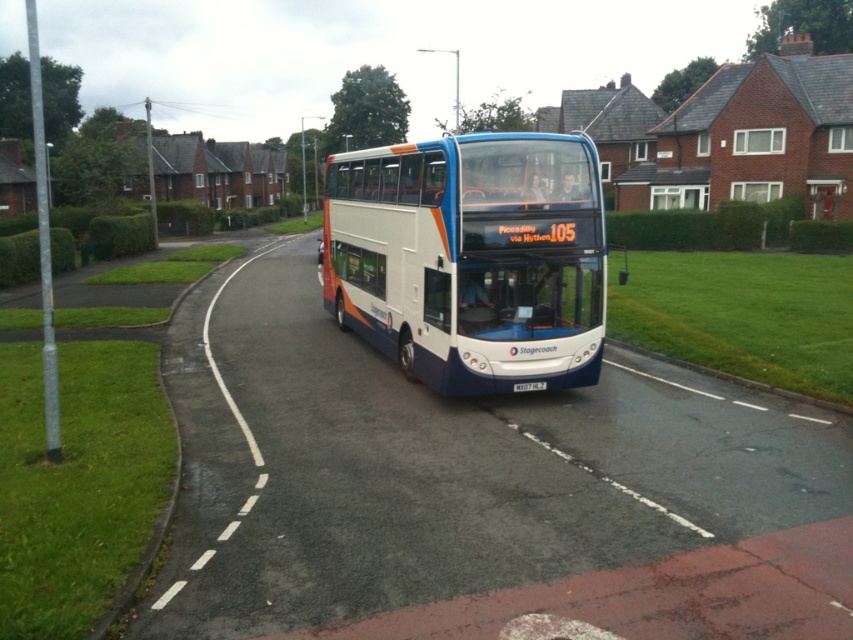
Question: Which point is closer to the camera taking this photo?

Choices:
 (A) (543, 387)
 (B) (440, 300)

Answer: (B)

Question: Does white glossy decker bus at center appear on the right side of white plastic license plate at center?

Choices:
 (A) yes
 (B) no

Answer: (B)

Question: Which point is closer to the camera taking this photo?

Choices:
 (A) (527, 385)
 (B) (436, 349)

Answer: (A)

Question: Can you confirm if white glossy decker bus at center is positioned to the right of white plastic license plate at center?

Choices:
 (A) yes
 (B) no

Answer: (B)

Question: Is white glossy decker bus at center behind white plastic license plate at center?

Choices:
 (A) yes
 (B) no

Answer: (B)